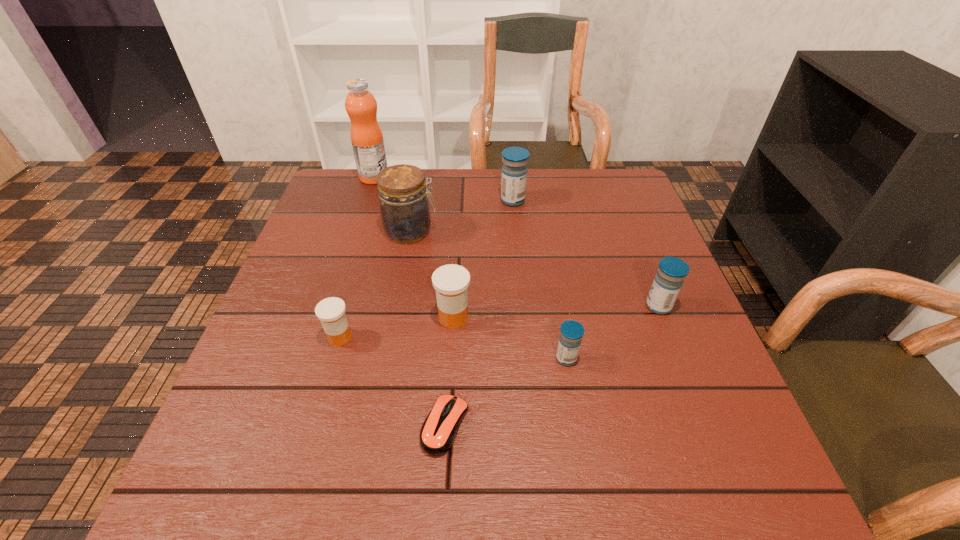
The image size is (960, 540). I want to click on unoccupied area between the rightmost object and the nearest blue medicine, so click(612, 332).

Find the location of a particular element. The image size is (960, 540). vacant area between the fruit juice and the fourth medicine from left to right is located at coordinates (470, 268).

Find the location of a particular element. The image size is (960, 540). free spot between the smaller orange medicine and the nearest blue medicine is located at coordinates (453, 348).

Find the location of a particular element. vacant space in between the fourth medicine from right to left and the fruit juice is located at coordinates (414, 247).

This screenshot has height=540, width=960. What are the coordinates of `free space between the nearest blue medicine and the tallest object` in the screenshot? It's located at (470, 268).

Locate an element on the screen. Image resolution: width=960 pixels, height=540 pixels. empty space that is in between the right orange medicine and the farthest blue medicine is located at coordinates (483, 259).

Choose which object is the nearest neighbor to the seventh farthest object. Please provide its 2D coordinates. Your answer should be formatted as a tuple, i.e. [(x, y)], where the tuple contains the x and y coordinates of a point satisfying the conditions above.

[(451, 282)]

Identify the location of object that is the nearest to the second smallest blue medicine. This screenshot has height=540, width=960. (571, 332).

Where is `medicine object that ranks as the fourth closest to the fruit juice`? This screenshot has height=540, width=960. medicine object that ranks as the fourth closest to the fruit juice is located at coordinates (571, 332).

Where is `medicine that is the second nearest to the jar`? medicine that is the second nearest to the jar is located at coordinates (451, 282).